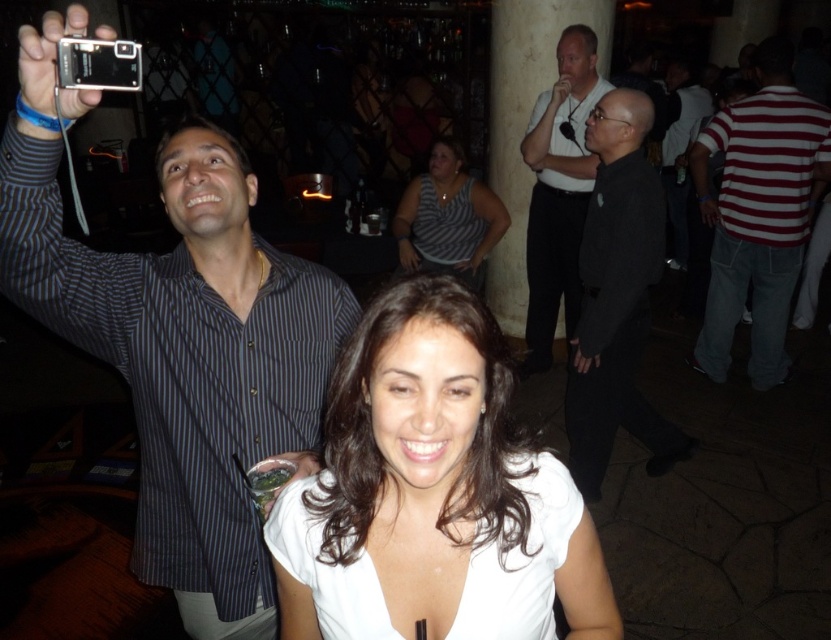
Question: Can you confirm if white matte shirt at center is positioned to the left of black matte shirt at center?

Choices:
 (A) yes
 (B) no

Answer: (A)

Question: Which is nearer to the red striped shirt at right?

Choices:
 (A) striped shirt at upper left
 (B) white matte shirt at upper center

Answer: (B)

Question: Is striped shirt at upper left below black matte shirt at center?

Choices:
 (A) no
 (B) yes

Answer: (B)

Question: Which object appears closest to the camera in this image?

Choices:
 (A) white matte shirt at upper center
 (B) striped shirt at upper left
 (C) white matte shirt at center

Answer: (C)

Question: Is striped shirt at upper left below red striped shirt at right?

Choices:
 (A) no
 (B) yes

Answer: (B)

Question: Which object is the farthest from the black matte shirt at center?

Choices:
 (A) white matte shirt at center
 (B) red striped shirt at right
 (C) striped fabric shirt at center
 (D) striped shirt at upper left

Answer: (A)